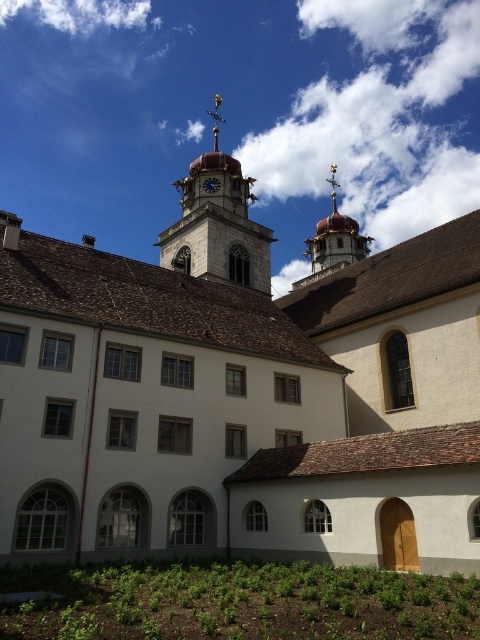
Question: Among these points, which one is farthest from the camera?

Choices:
 (A) (328, 224)
 (B) (208, 179)

Answer: (A)

Question: Which of the following is the closest to the observer?

Choices:
 (A) (210, 186)
 (B) (335, 246)

Answer: (A)

Question: Can you confirm if shiny gold spire at upper center is positioned to the left of blue painted wood clock at center?

Choices:
 (A) no
 (B) yes

Answer: (A)

Question: Estimate the real-world distances between objects in this image. Which object is closer to the shiny gold spire at upper center?

Choices:
 (A) blue painted wood clock at center
 (B) smooth stone clock tower at upper center

Answer: (B)

Question: Does smooth stone clock tower at upper center have a greater width compared to blue painted wood clock at center?

Choices:
 (A) no
 (B) yes

Answer: (B)

Question: Does smooth stone clock tower at upper center have a greater width compared to blue painted wood clock at center?

Choices:
 (A) yes
 (B) no

Answer: (A)